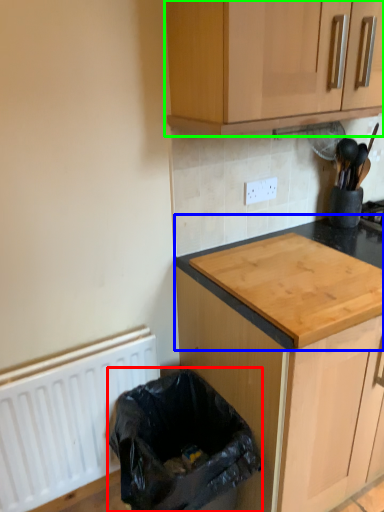
Question: Which is nearer to the recycling bin (highlighted by a red box)? countertop (highlighted by a blue box) or cabinetry (highlighted by a green box).

Choices:
 (A) countertop
 (B) cabinetry

Answer: (A)